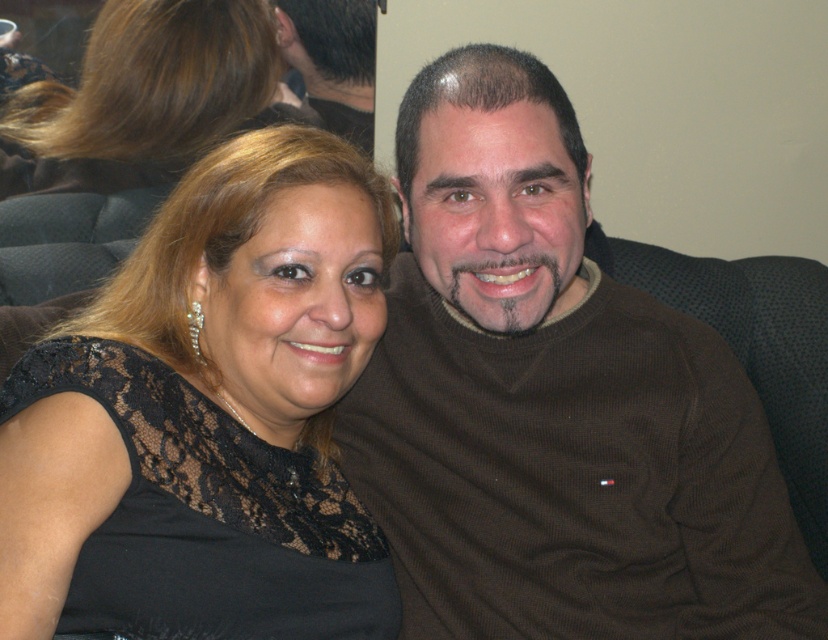
Question: Can you confirm if brown lace dress at upper left is positioned to the left of dark brown hair at upper center?

Choices:
 (A) no
 (B) yes

Answer: (B)

Question: Which object appears closest to the camera in this image?

Choices:
 (A) dark brown hair at upper center
 (B) brown sweater at center

Answer: (B)

Question: Observing the image, what is the correct spatial positioning of brown sweater at center in reference to brown lace dress at upper left?

Choices:
 (A) below
 (B) above

Answer: (A)

Question: Estimate the real-world distances between objects in this image. Which object is farther from the brown sweater at center?

Choices:
 (A) dark brown hair at upper center
 (B) brown lace dress at upper left
 (C) black lace dress at upper left

Answer: (A)

Question: Which of the following is the farthest from the observer?

Choices:
 (A) dark brown hair at upper center
 (B) brown sweater at center

Answer: (A)

Question: Does black lace dress at upper left lie behind dark brown hair at upper center?

Choices:
 (A) yes
 (B) no

Answer: (B)